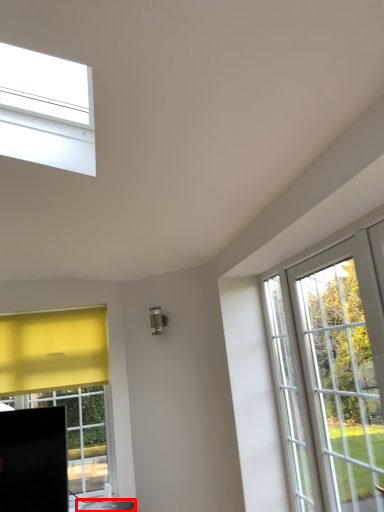
Question: From the image's perspective, what is the correct spatial positioning of furniture (annotated by the red box) in reference to screen door?

Choices:
 (A) above
 (B) below

Answer: (B)